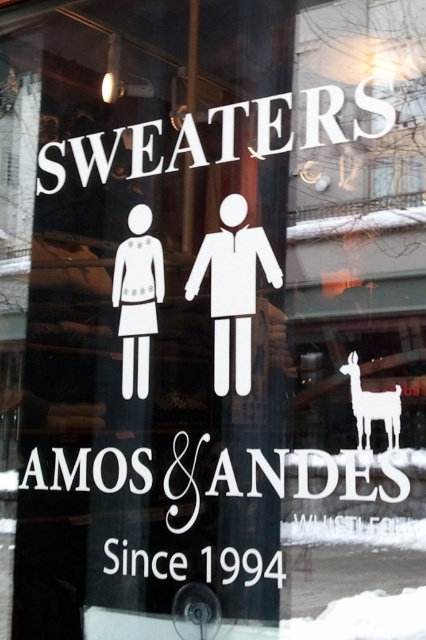
You are designing a layout for the storefront window and need to place the white matte sign at upper center and the white matte llama at upper right. Based on their sizes, which object should be placed first to ensure they fit properly?

The white matte sign at upper center might be wider than the white matte llama at upper right, so it should be placed first to ensure there is enough space for both.

You are a customer standing in front of the Amos and Andes storefront window. You notice the white matte sign at upper center and the white paper figure at left. Which object is wider?

The white matte sign at upper center might be wider than the white paper figure at left according to the description.

You are a customer looking at the Amos and Andes storefront window. You see the white matte sign at upper center and the white paper figure at left. Which object is higher in the image?

The white matte sign at upper center is above the white paper figure at left, so it is higher in the image.